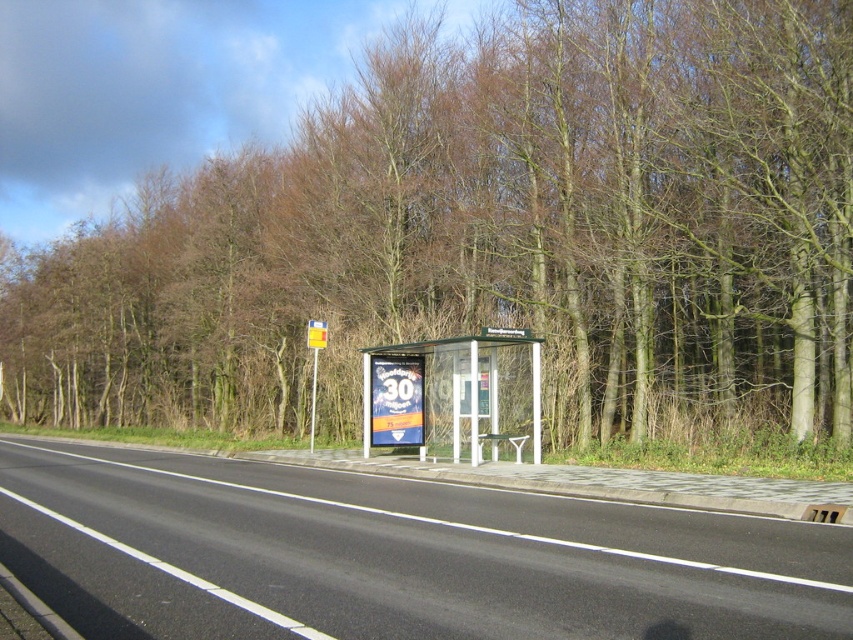
In the scene shown: You are a pedestrian standing at the edge of the road. You see the black asphalt highway at center and the transparent plastic bus stop at center. Which object is closer to the ground?

The black asphalt highway at center is closer to the ground because it is located below the transparent plastic bus stop at center.

From the picture: You are a driver approaching the black asphalt highway at center and the yellow plastic sign at center. Which object will appear taller from your perspective?

The yellow plastic sign at center appears taller than the black asphalt highway at center because the yellow plastic sign at center is taller than it.

In the scene shown: You are standing at the bus stop shelter and want to take a photo of both the point at coordinates [360,252] and the point at coordinates [485,435]. Which point should you focus on first to ensure both are in focus?

You should focus on the point at coordinates [360,252] first because it is closer to you than the point at coordinates [485,435]. This way, both points will be in focus as the closer point determines the focal plane.